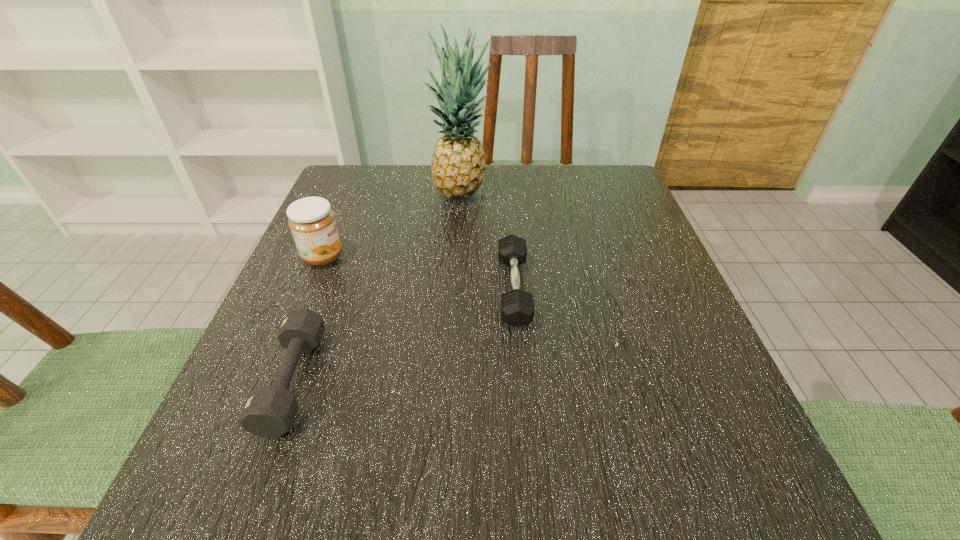
At what (x,y) coordinates should I click in order to perform the action: click on vacant area at the far right corner of the desktop. Please return your answer as a coordinate pair (x, y). Looking at the image, I should click on (625, 187).

You are a GUI agent. You are given a task and a screenshot of the screen. Output one action in this format:
    pyautogui.click(x=<x>, y=<y>)
    Task: Click on the free spot between the right dumbbell and the nearer dumbbell
    This screenshot has width=960, height=540.
    Given the screenshot: What is the action you would take?
    pyautogui.click(x=403, y=335)

This screenshot has height=540, width=960. I want to click on free space between the third object from left to right and the farther dumbbell, so click(488, 241).

Identify the location of unoccupied position between the nearest object and the farther dumbbell. (403, 335).

You are a GUI agent. You are given a task and a screenshot of the screen. Output one action in this format:
    pyautogui.click(x=<x>, y=<y>)
    Task: Click on the free point between the pineapple and the nearer dumbbell
    
    Given the screenshot: What is the action you would take?
    pyautogui.click(x=377, y=287)

Locate an element on the screen. The height and width of the screenshot is (540, 960). free space between the tallest object and the second tallest object is located at coordinates (392, 226).

Find the location of `vacant area between the nearest object and the farther dumbbell`. vacant area between the nearest object and the farther dumbbell is located at coordinates (403, 335).

Image resolution: width=960 pixels, height=540 pixels. I want to click on object that is the third nearest to the jam, so click(517, 306).

Point out which object is positioned as the second nearest to the farther dumbbell. Please provide its 2D coordinates. Your answer should be formatted as a tuple, i.e. [(x, y)], where the tuple contains the x and y coordinates of a point satisfying the conditions above.

[(270, 411)]

Locate an element on the screen. The image size is (960, 540). free space that satisfies the following two spatial constraints: 1. on the back side of the left dumbbell; 2. on the front label of the jam is located at coordinates (339, 257).